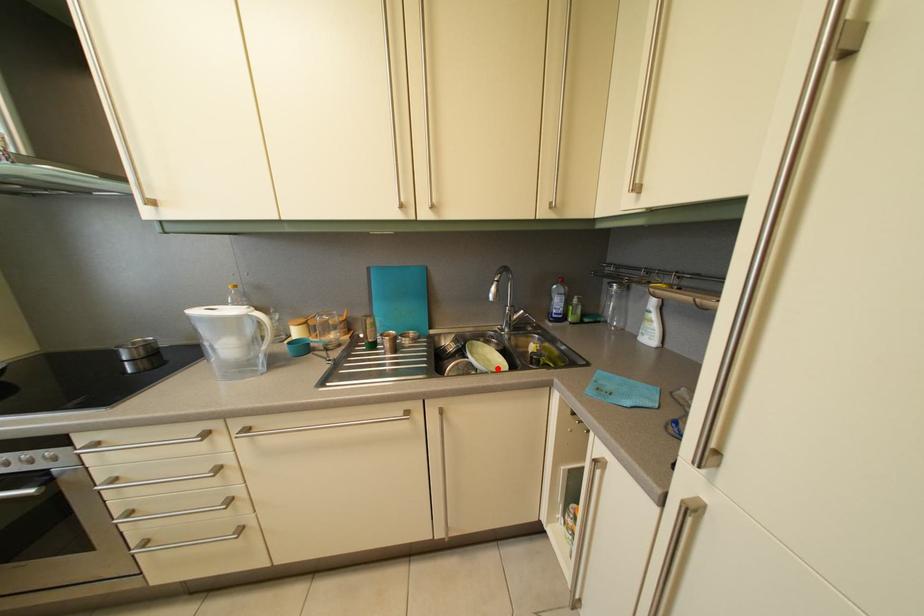
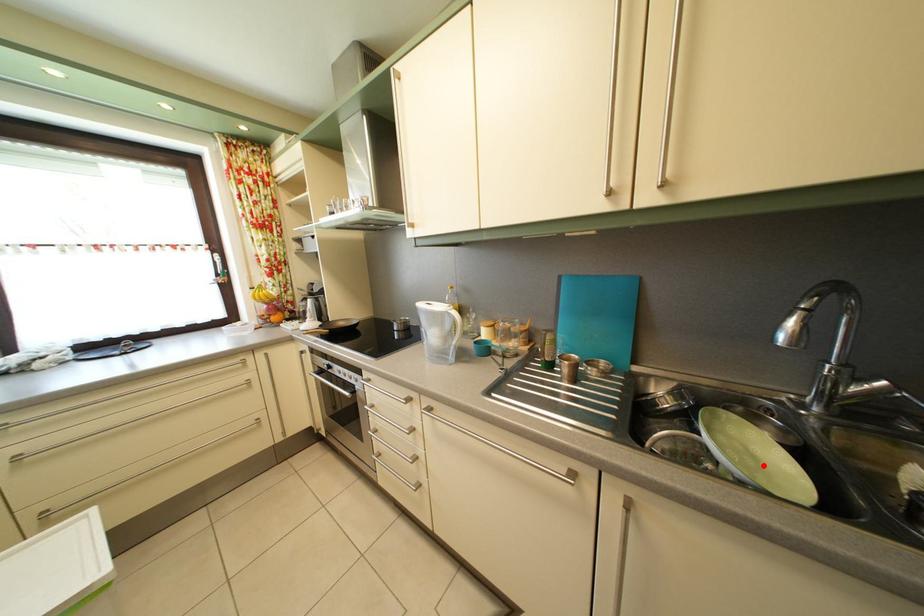
I am providing you with two images of the same scene from different viewpoints. A red point is marked on the first image and another point is marked on the second image. Are the points marked in image1 and image2 representing the same 3D position?

Yes